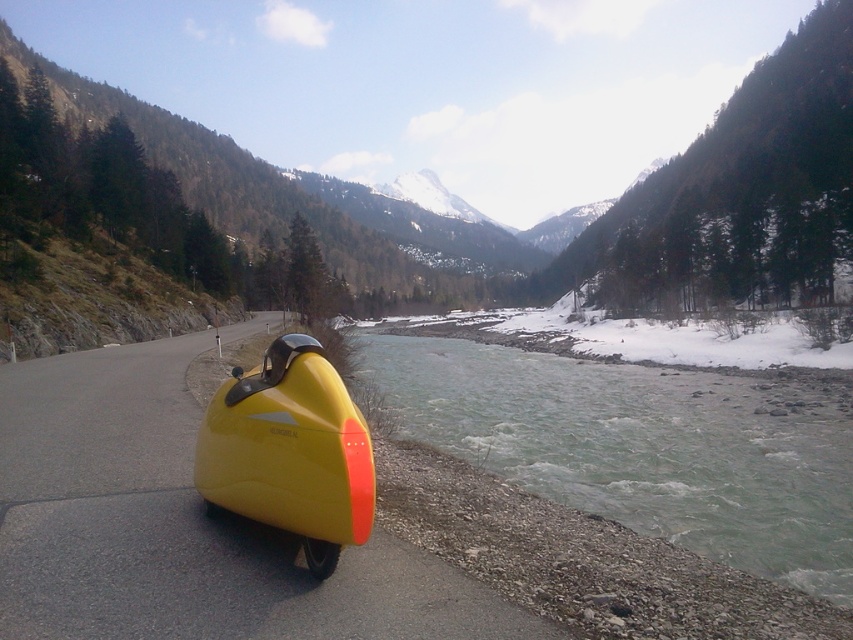
Does greenish-gray water at lower center have a lesser height compared to yellow matte sidecar at left?

No.

Is point (682, 452) closer to viewer compared to point (297, 388)?

No, it is behind (297, 388).

Describe the element at coordinates (641, 448) in the screenshot. I see `greenish-gray water at lower center` at that location.

This screenshot has width=853, height=640. Find the location of `greenish-gray water at lower center`. greenish-gray water at lower center is located at coordinates (641, 448).